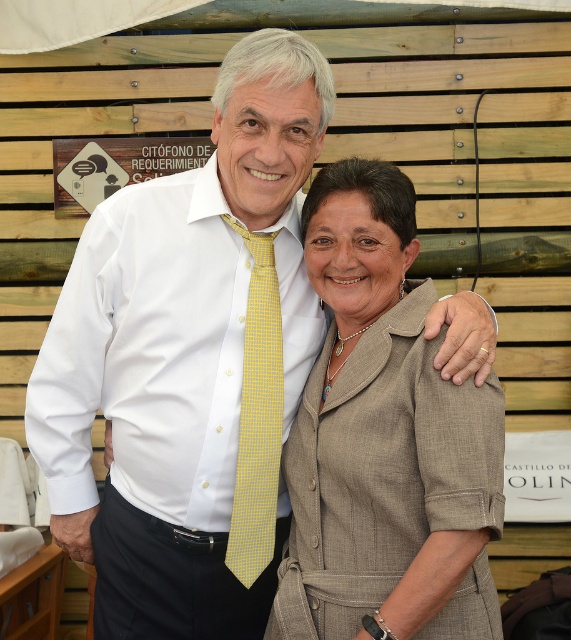
Between point (409, 237) and point (272, 492), which one is positioned in front?

Point (409, 237) is more forward.

Can you confirm if matte beige suit at center is positioned to the left of yellow checkered tie at center?

Incorrect, matte beige suit at center is not on the left side of yellow checkered tie at center.

Which is behind, point (329, 554) or point (259, 484)?

Point (259, 484)

At what (x,y) coordinates should I click in order to perform the action: click on matte beige suit at center. Please return your answer as a coordinate pair (x, y). Looking at the image, I should click on (384, 440).